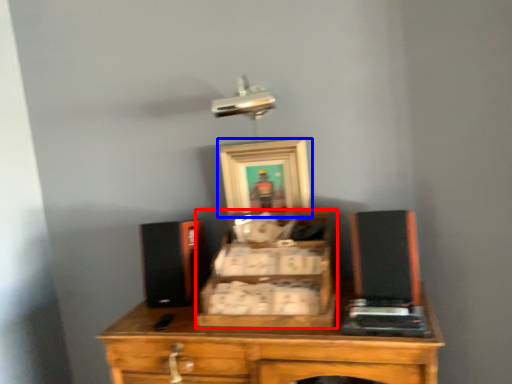
Question: Which of the following is the farthest to the observer, drawer (highlighted by a red box) or picture frame (highlighted by a blue box)?

Choices:
 (A) drawer
 (B) picture frame

Answer: (B)